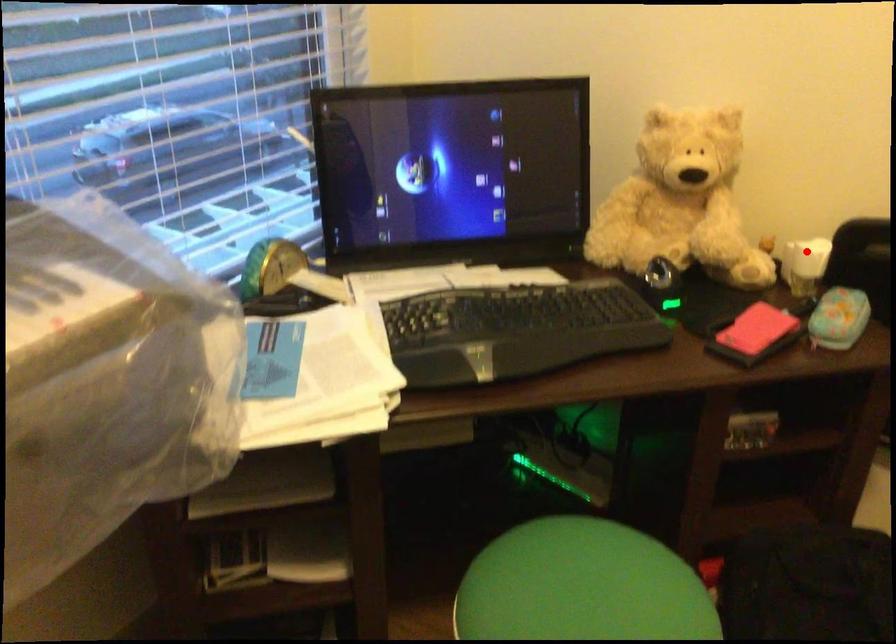
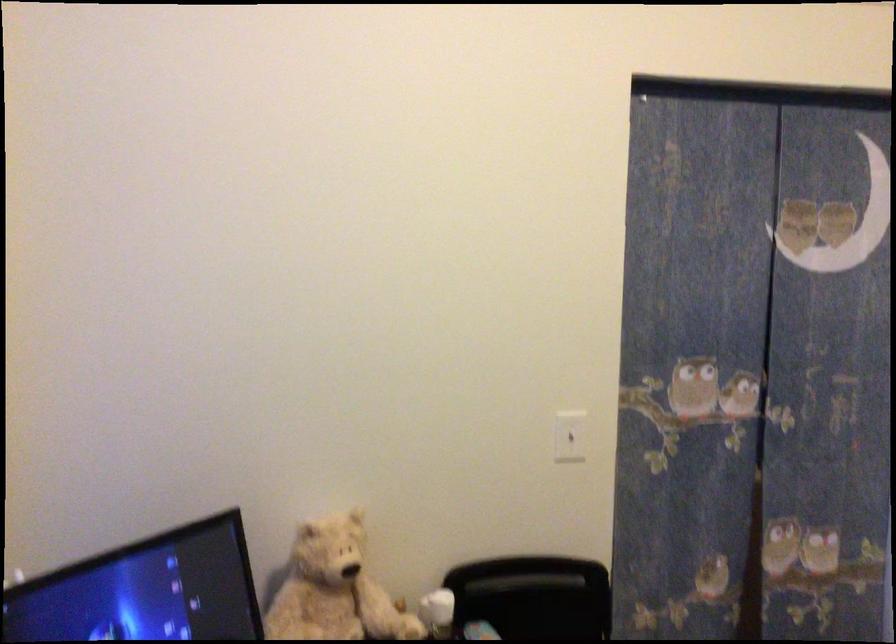
Where in the second image is the point corresponding to the highlighted location from the first image?

(437, 612)